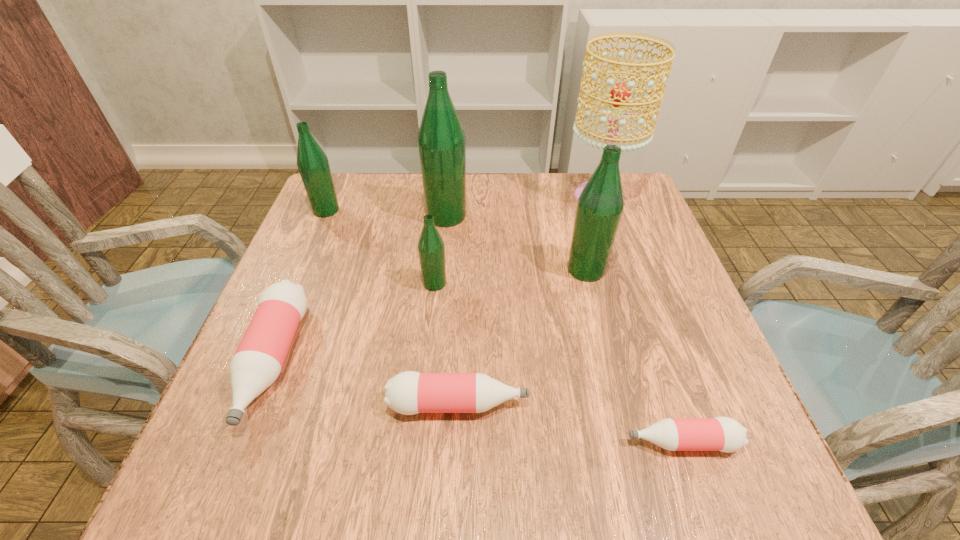
Identify the location of vacant space located with the cap open on the rightmost pink bottle. The height and width of the screenshot is (540, 960). (564, 442).

At what (x,y) coordinates should I click in order to perform the action: click on blank space located 0.370m with the cap open on the rightmost pink bottle. Please return your answer as a coordinate pair (x, y). Looking at the image, I should click on (396, 442).

Identify the location of free location located with the cap open on the rightmost pink bottle. This screenshot has height=540, width=960. (526, 442).

Find the location of a particular element. Image resolution: width=960 pixels, height=540 pixels. lampshade that is positioned at the far edge is located at coordinates (620, 93).

Where is `object that is at the near edge`? object that is at the near edge is located at coordinates (724, 434).

The image size is (960, 540). Find the location of `lampshade located in the right edge section of the desktop`. lampshade located in the right edge section of the desktop is located at coordinates (620, 93).

Identify the location of object that is positioned at the far left corner. (313, 165).

You are a GUI agent. You are given a task and a screenshot of the screen. Output one action in this format:
    pyautogui.click(x=<x>, y=<y>)
    Task: Click on the object that is at the far right corner
    This screenshot has width=960, height=540.
    Given the screenshot: What is the action you would take?
    pyautogui.click(x=620, y=93)

Find the location of a particular element. object positioned at the near right corner is located at coordinates (724, 434).

In the image, there is a desktop. Find the location of `vacant space at the far edge`. vacant space at the far edge is located at coordinates click(x=568, y=195).